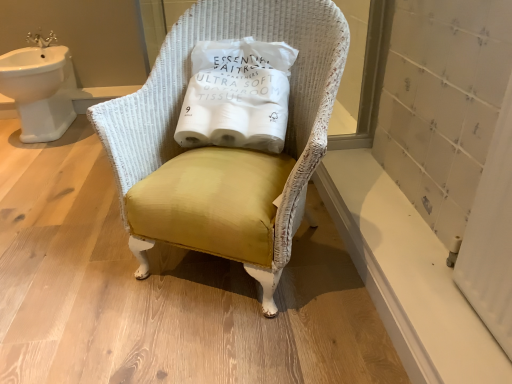
Locate an element on the screen. free space in front of white ceramic sink at upper left is located at coordinates (56, 159).